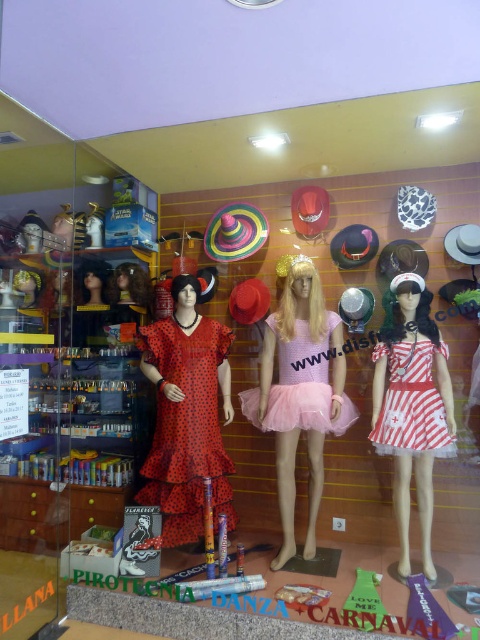
Does red dotted fabric dress at center appear under pink tulle dress at center?

Yes, red dotted fabric dress at center is below pink tulle dress at center.

The image size is (480, 640). What do you see at coordinates (187, 428) in the screenshot?
I see `red dotted fabric dress at center` at bounding box center [187, 428].

What do you see at coordinates (187, 428) in the screenshot?
I see `red dotted fabric dress at center` at bounding box center [187, 428].

Locate an element on the screen. red dotted fabric dress at center is located at coordinates (187, 428).

Does pink crochet tutu at center appear on the right side of red dotted fabric dress at center?

Correct, you'll find pink crochet tutu at center to the right of red dotted fabric dress at center.

Can you confirm if pink crochet tutu at center is shorter than red dotted fabric dress at center?

No.

Who is more distant from viewer, (264, 368) or (184, 372)?

Point (264, 368)

The image size is (480, 640). What are the coordinates of `pink crochet tutu at center` in the screenshot? It's located at (300, 394).

Identify the location of pink crochet tutu at center. The width and height of the screenshot is (480, 640). (300, 394).

Where is `pink crochet tutu at center`? This screenshot has height=640, width=480. pink crochet tutu at center is located at coordinates (300, 394).